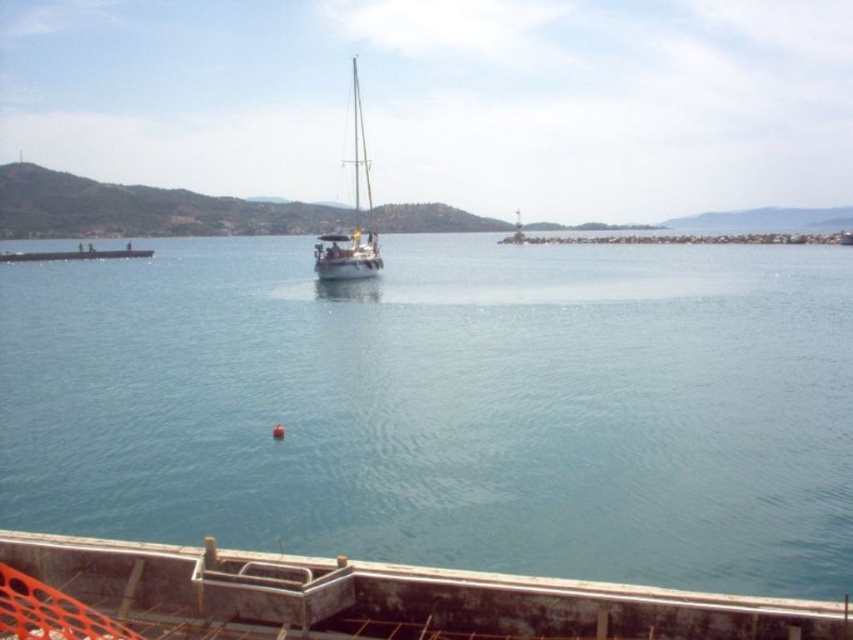
You are standing on the concrete dock at lower center and want to board the white glossy sailboat at center. Which direction should you move to reach the boat?

Since the concrete dock at lower center is located below the white glossy sailboat at center, you should move upward to reach the boat.

You are standing at the point marked by the coordinates point (351, 600) in the image. Looking around, you see a red buoy and a sailboat. Which object is closer to your current position?

The concrete dock at lower center is marked by point (351, 600). Since you are standing at this point, you are already at the concrete dock at lower center. Therefore, the red buoy and the sailboat are both at varying distances from your position. However, the sailboat is in the middle ground, closer to the viewer than the distant horizon, while the red buoy is near the center of the frame. To determine which is closer, consider their positions relative to your location at the dock. The red buoy is near,